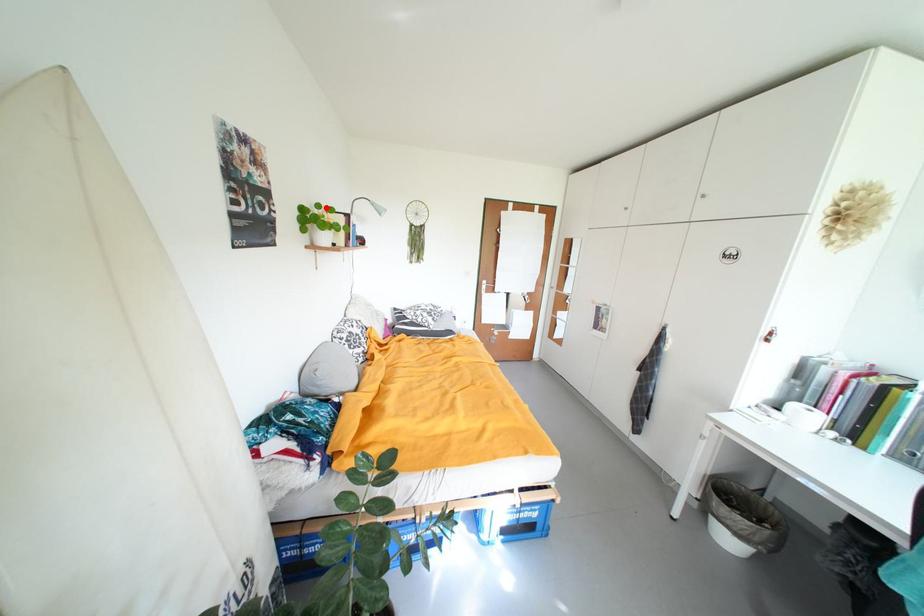
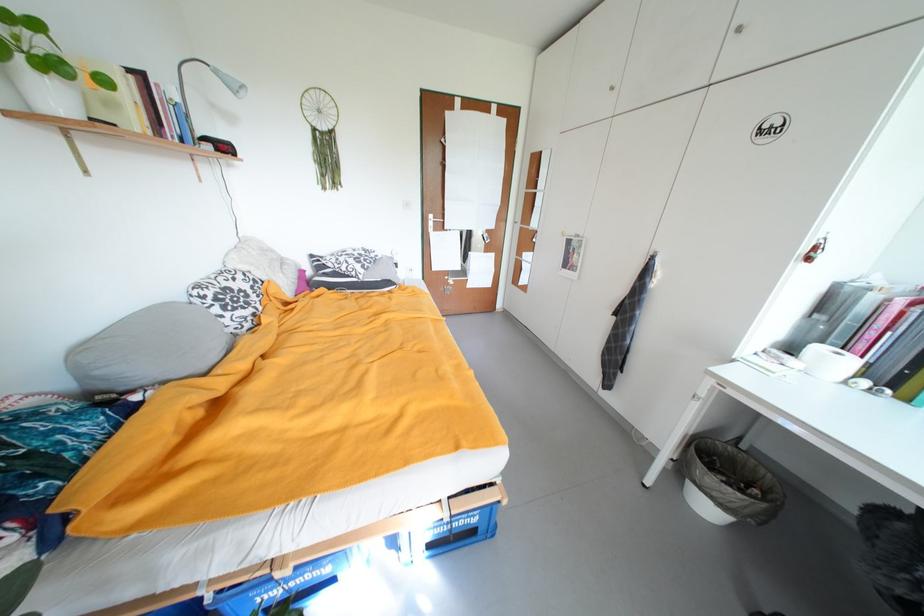
Question: I am providing you with two images of the same scene from different viewpoints. In image1, a red point is highlighted. Considering the same 3D point in image2, which of the following is correct?

Choices:
 (A) It is closer
 (B) It is farther

Answer: (B)